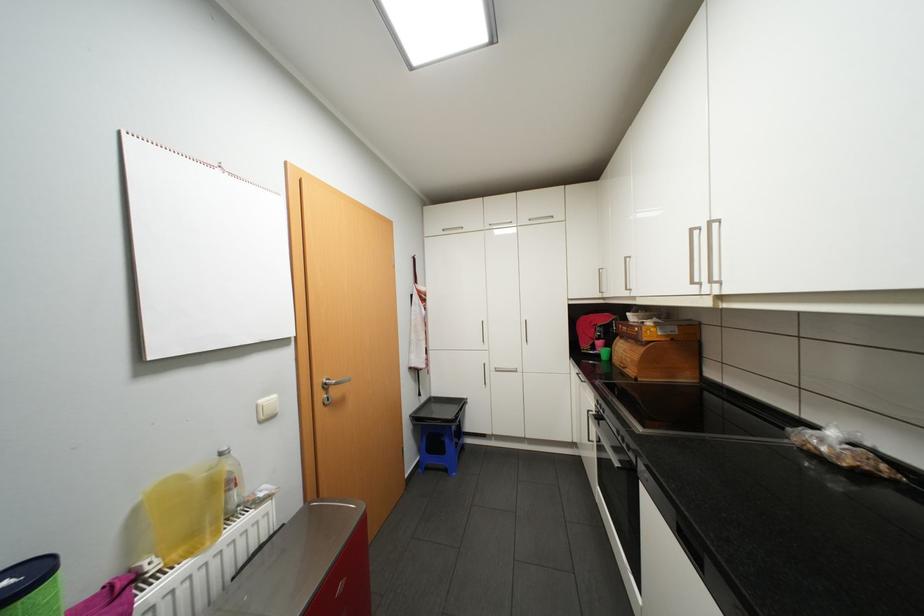
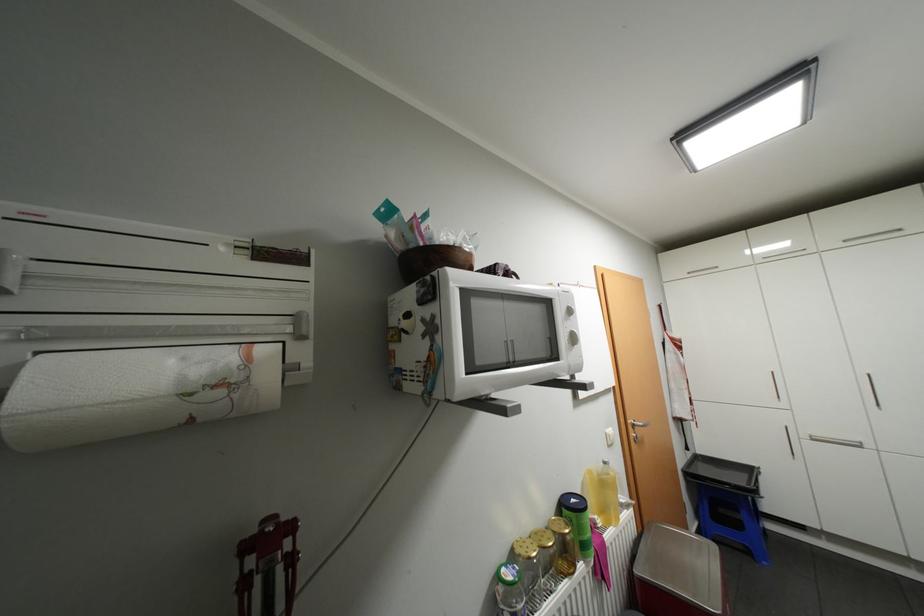
Find the pixel in the second image that matches point 431,398 in the first image.

(697, 453)